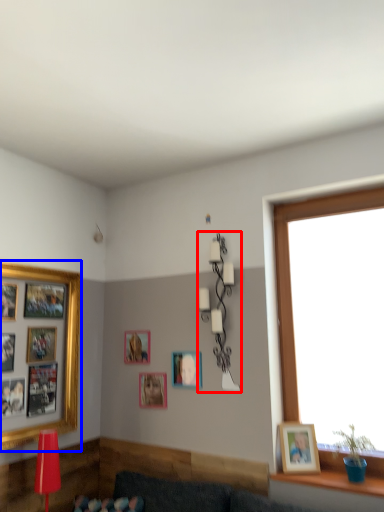
Question: Which point is further to the camera, lamp (highlighted by a red box) or picture frame (highlighted by a blue box)?

Choices:
 (A) lamp
 (B) picture frame

Answer: (A)